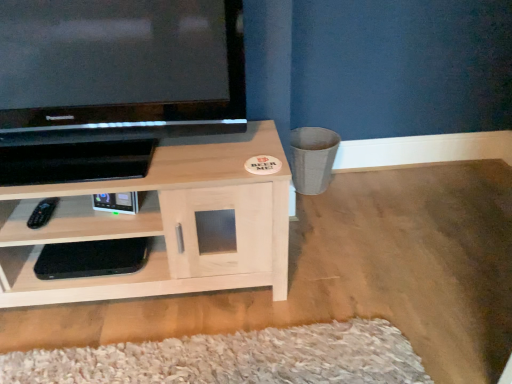
At what (x,y) coordinates should I click in order to perform the action: click on free space above light wood/woodenobject at lower left, the 1th shelf from the top (from a real-world perspective). Please return your answer as a coordinate pair (x, y). Looking at the image, I should click on (147, 157).